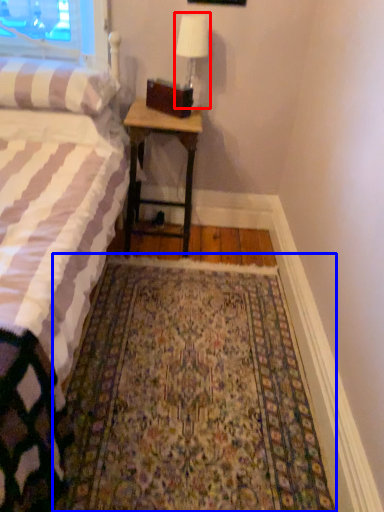
Question: Which of the following is the closest to the observer, bedside lamp (highlighted by a red box) or mat (highlighted by a blue box)?

Choices:
 (A) bedside lamp
 (B) mat

Answer: (B)